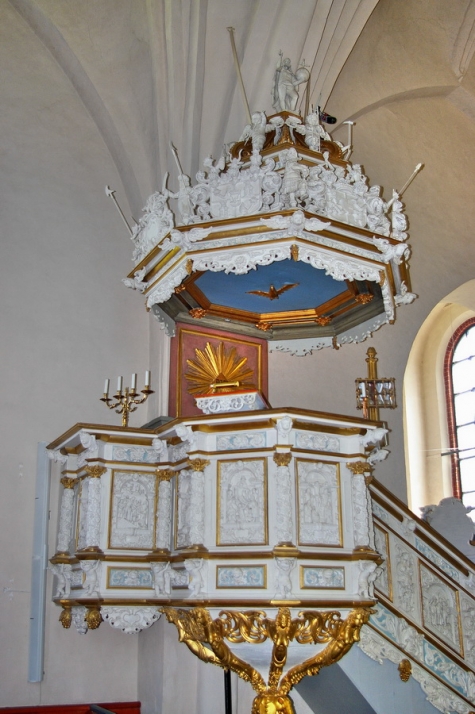
Identify the location of candle holder. (125, 417).